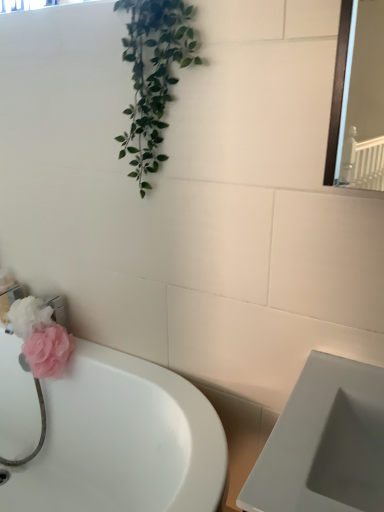
Image resolution: width=384 pixels, height=512 pixels. Describe the element at coordinates (116, 433) in the screenshot. I see `white glossy bathtub at lower left` at that location.

This screenshot has height=512, width=384. Find the location of `white glossy bathtub at lower left`. white glossy bathtub at lower left is located at coordinates (116, 433).

In order to face pink fabric flower at lower left, should I rotate leftwards or rightwards?

You should rotate left by 18.756 degrees.

The height and width of the screenshot is (512, 384). What do you see at coordinates (48, 351) in the screenshot?
I see `pink fabric flower at lower left` at bounding box center [48, 351].

Locate an element on the screen. pink fabric flower at lower left is located at coordinates (48, 351).

Locate an element on the screen. white glossy bathtub at lower left is located at coordinates (116, 433).

Would you say white glossy bathtub at lower left is to the left or to the right of pink fabric flower at lower left in the picture?

white glossy bathtub at lower left is to the left of pink fabric flower at lower left.

Considering their positions, is white glossy bathtub at lower left located in front of or behind pink fabric flower at lower left?

white glossy bathtub at lower left is positioned closer to the viewer than pink fabric flower at lower left.

Is point (73, 500) positioned after point (25, 350)?

No, it is not.

From the image's perspective, does white glossy bathtub at lower left appear lower than pink fabric flower at lower left?

Yes, from the image's perspective, white glossy bathtub at lower left is below pink fabric flower at lower left.

From a real-world perspective, is white glossy bathtub at lower left physically above pink fabric flower at lower left?

No, from a real-world perspective, white glossy bathtub at lower left is not over pink fabric flower at lower left

Does white glossy bathtub at lower left have a greater width compared to pink fabric flower at lower left?

Yes.

Is white glossy bathtub at lower left taller than pink fabric flower at lower left?

Indeed, white glossy bathtub at lower left has a greater height compared to pink fabric flower at lower left.

Which of these two, white glossy bathtub at lower left or pink fabric flower at lower left, is smaller?

pink fabric flower at lower left.

Is white glossy bathtub at lower left completely or partially outside of pink fabric flower at lower left?

That's correct, white glossy bathtub at lower left is outside of pink fabric flower at lower left.

Is white glossy bathtub at lower left far away from pink fabric flower at lower left?

white glossy bathtub at lower left is actually quite close to pink fabric flower at lower left.

Is pink fabric flower at lower left at the back of white glossy bathtub at lower left?

No, white glossy bathtub at lower left is not facing away from pink fabric flower at lower left.

Where is `bathtub that appears on the left of pink fabric flower at lower left`? This screenshot has height=512, width=384. bathtub that appears on the left of pink fabric flower at lower left is located at coordinates (116, 433).

Would you say pink fabric flower at lower left is to the left or to the right of white glossy bathtub at lower left in the picture?

From the image, it's evident that pink fabric flower at lower left is to the right of white glossy bathtub at lower left.

Which object is closer to the camera taking this photo, pink fabric flower at lower left or white glossy bathtub at lower left?

white glossy bathtub at lower left.

Is point (35, 376) in front of point (91, 482)?

Yes, it is in front of point (91, 482).

From the image's perspective, which one is positioned lower, pink fabric flower at lower left or white glossy bathtub at lower left?

white glossy bathtub at lower left.

From a real-world perspective, is pink fabric flower at lower left over white glossy bathtub at lower left?

Yes, from a real-world perspective, pink fabric flower at lower left is on top of white glossy bathtub at lower left.

Looking at their sizes, would you say pink fabric flower at lower left is wider or thinner than white glossy bathtub at lower left?

Clearly, pink fabric flower at lower left has less width compared to white glossy bathtub at lower left.

Considering the relative sizes of pink fabric flower at lower left and white glossy bathtub at lower left in the image provided, is pink fabric flower at lower left taller than white glossy bathtub at lower left?

In fact, pink fabric flower at lower left may be shorter than white glossy bathtub at lower left.

From the picture: Between pink fabric flower at lower left and white glossy bathtub at lower left, which one has larger size?

With larger size is white glossy bathtub at lower left.

Is pink fabric flower at lower left positioned beyond the bounds of white glossy bathtub at lower left?

Actually, pink fabric flower at lower left is within white glossy bathtub at lower left.

Are pink fabric flower at lower left and white glossy bathtub at lower left beside each other?

pink fabric flower at lower left and white glossy bathtub at lower left are not in contact.

Does pink fabric flower at lower left turn towards white glossy bathtub at lower left?

No, pink fabric flower at lower left is not facing towards white glossy bathtub at lower left.

Measure the distance from pink fabric flower at lower left to white glossy bathtub at lower left.

pink fabric flower at lower left is 9.37 inches away from white glossy bathtub at lower left.

Locate an element on the screen. This screenshot has height=512, width=384. flower that appears above the white glossy bathtub at lower left (from the image's perspective) is located at coordinates (48, 351).

This screenshot has height=512, width=384. I want to click on flower located behind the white glossy bathtub at lower left, so click(48, 351).

Find the location of a particular element. bathtub on the left of pink fabric flower at lower left is located at coordinates (116, 433).